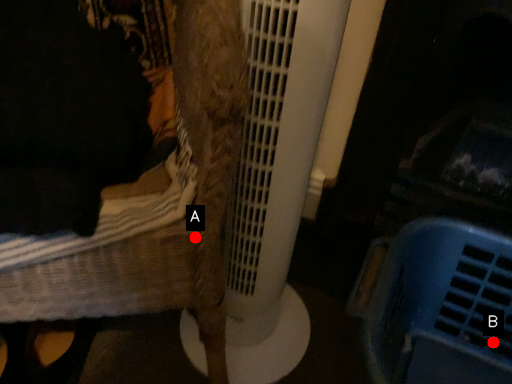
Question: Two points are circled on the image, labeled by A and B beside each circle. Which point appears farthest from the camera in this image?

Choices:
 (A) A is further
 (B) B is further

Answer: (B)